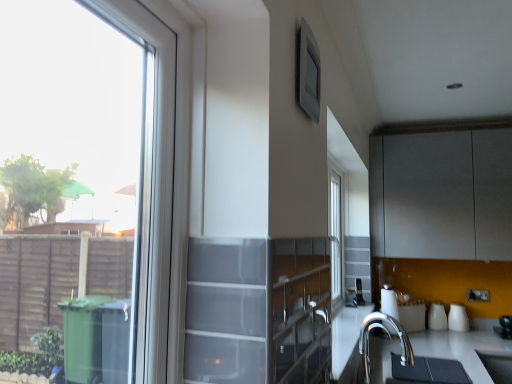
Question: Considering the relative positions of white glossy cups at lower right, placed as the second appliance when sorted from right to left, and polished chrome faucet at lower right in the image provided, is white glossy cups at lower right, placed as the second appliance when sorted from right to left, to the right of polished chrome faucet at lower right from the viewer's perspective?

Choices:
 (A) yes
 (B) no

Answer: (A)

Question: Considering the relative sizes of white glossy cups at lower right, placed as the second appliance when sorted from right to left, and polished chrome faucet at lower right in the image provided, is white glossy cups at lower right, placed as the second appliance when sorted from right to left, shorter than polished chrome faucet at lower right?

Choices:
 (A) yes
 (B) no

Answer: (A)

Question: Is white glossy cups at lower right, placed as the second appliance when sorted from right to left, outside polished chrome faucet at lower right?

Choices:
 (A) no
 (B) yes

Answer: (B)

Question: Does white glossy cups at lower right, marked as the second appliance in a left-to-right arrangement, have a greater width compared to polished chrome faucet at lower right?

Choices:
 (A) yes
 (B) no

Answer: (B)

Question: Is the position of white glossy cups at lower right, placed as the second appliance when sorted from right to left, more distant than that of polished chrome faucet at lower right?

Choices:
 (A) yes
 (B) no

Answer: (A)

Question: From the image's perspective, is white glossy vase at right, the 3th appliance when ordered from left to right, located above matte gray cabinet at upper right?

Choices:
 (A) no
 (B) yes

Answer: (A)

Question: Is white glossy vase at right, the 3th appliance when ordered from left to right, located outside matte gray cabinet at upper right?

Choices:
 (A) no
 (B) yes

Answer: (B)

Question: Is white glossy vase at right, marked as the first appliance in a right-to-left arrangement, aimed at matte gray cabinet at upper right?

Choices:
 (A) no
 (B) yes

Answer: (A)

Question: Is white glossy vase at right, the 3th appliance when ordered from left to right, shorter than matte gray cabinet at upper right?

Choices:
 (A) no
 (B) yes

Answer: (B)

Question: Is white glossy vase at right, the 3th appliance when ordered from left to right, wider than matte gray cabinet at upper right?

Choices:
 (A) yes
 (B) no

Answer: (B)

Question: Is white glossy vase at right, marked as the first appliance in a right-to-left arrangement, positioned before matte gray cabinet at upper right?

Choices:
 (A) yes
 (B) no

Answer: (B)

Question: Is clear glass window at left facing towards white glossy vase at right, the 3th appliance when ordered from left to right?

Choices:
 (A) yes
 (B) no

Answer: (B)